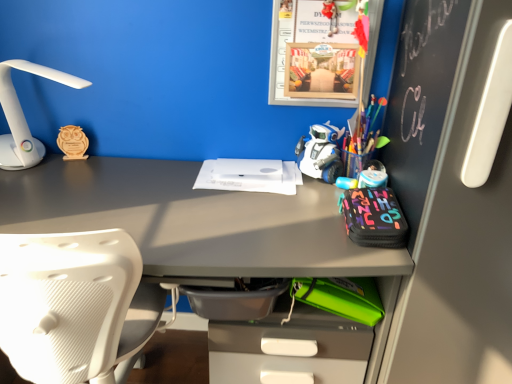
Question: In the image, is white textured chair at left on the left side or the right side of wooden owl at left?

Choices:
 (A) right
 (B) left

Answer: (A)

Question: From a real-world perspective, is white textured chair at left above or below wooden owl at left?

Choices:
 (A) above
 (B) below

Answer: (B)

Question: Which is nearer to the white textured chair at left?

Choices:
 (A) matte gray desk at center
 (B) white matte paper at center
 (C) white plastic lamp at left
 (D) wooden owl at left
 (E) white plastic robot at center

Answer: (A)

Question: Which is farther from the white plastic robot at center?

Choices:
 (A) white textured chair at left
 (B) white matte paper at center
 (C) matte gray desk at center
 (D) wooden owl at left
 (E) white plastic lamp at left

Answer: (E)